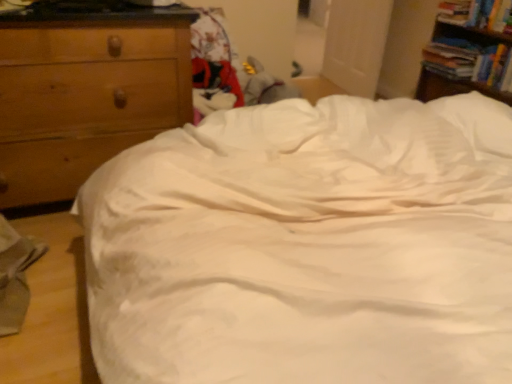
Question: Is wooden chest of drawers at left at the right side of hardcover book at upper right, the 2th book in the bottom-to-top sequence?

Choices:
 (A) no
 (B) yes

Answer: (A)

Question: Considering the relative positions of wooden chest of drawers at left and hardcover book at upper right, the 2th book in the bottom-to-top sequence, in the image provided, is wooden chest of drawers at left behind hardcover book at upper right, the 2th book in the bottom-to-top sequence,?

Choices:
 (A) yes
 (B) no

Answer: (B)

Question: Does wooden chest of drawers at left lie in front of hardcover book at upper right, which is the second book from top to bottom?

Choices:
 (A) yes
 (B) no

Answer: (A)

Question: Is hardcover book at upper right, which is the second book from top to bottom, located within wooden chest of drawers at left?

Choices:
 (A) yes
 (B) no

Answer: (B)

Question: Does wooden chest of drawers at left have a lesser width compared to hardcover book at upper right, the 2th book in the bottom-to-top sequence?

Choices:
 (A) yes
 (B) no

Answer: (B)

Question: From their relative heights in the image, would you say hardcover book at upper right, the first book positioned from the bottom, is taller or shorter than hardcover book at upper right, the 2th book in the bottom-to-top sequence?

Choices:
 (A) tall
 (B) short

Answer: (B)

Question: Considering the positions of hardcover book at upper right, the first book positioned from the bottom, and hardcover book at upper right, the 2th book in the bottom-to-top sequence, in the image, is hardcover book at upper right, the first book positioned from the bottom, bigger or smaller than hardcover book at upper right, the 2th book in the bottom-to-top sequence,?

Choices:
 (A) big
 (B) small

Answer: (A)

Question: Choose the correct answer: Is hardcover book at upper right, marked as the 3th book in a top-to-bottom arrangement, inside hardcover book at upper right, which is the second book from top to bottom, or outside it?

Choices:
 (A) inside
 (B) outside

Answer: (B)

Question: Relative to hardcover book at upper right, which is the second book from top to bottom, is hardcover book at upper right, marked as the 3th book in a top-to-bottom arrangement, in front or behind?

Choices:
 (A) front
 (B) behind

Answer: (B)

Question: From the image's perspective, is wooden chest of drawers at left located above or below wooden bookshelf at upper right?

Choices:
 (A) above
 (B) below

Answer: (B)

Question: Considering their positions, is wooden chest of drawers at left located in front of or behind wooden bookshelf at upper right?

Choices:
 (A) front
 (B) behind

Answer: (A)

Question: In terms of width, does wooden chest of drawers at left look wider or thinner when compared to wooden bookshelf at upper right?

Choices:
 (A) thin
 (B) wide

Answer: (B)

Question: Does point (41, 34) appear closer or farther from the camera than point (505, 59)?

Choices:
 (A) farther
 (B) closer

Answer: (B)

Question: Considering the relative positions of wooden chest of drawers at left and hardcover book at upper right, which is counted as the 3th book, starting from the bottom, in the image provided, is wooden chest of drawers at left to the left or to the right of hardcover book at upper right, which is counted as the 3th book, starting from the bottom,?

Choices:
 (A) right
 (B) left

Answer: (B)

Question: Does point (95, 167) appear closer or farther from the camera than point (463, 21)?

Choices:
 (A) farther
 (B) closer

Answer: (B)